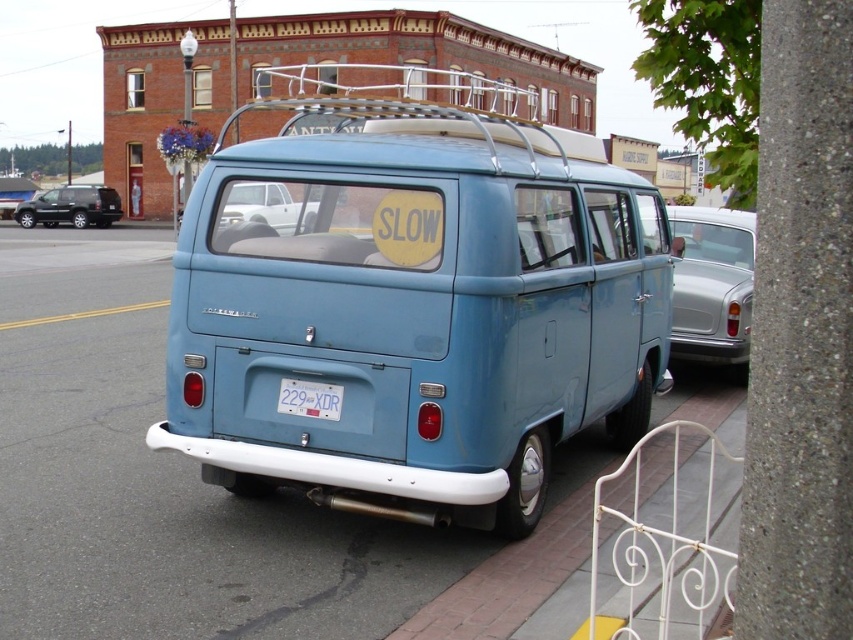
Describe the element at coordinates (412, 304) in the screenshot. Image resolution: width=853 pixels, height=640 pixels. I see `matte blue van at center` at that location.

The height and width of the screenshot is (640, 853). In order to click on matte blue van at center in this screenshot , I will do `click(412, 304)`.

The height and width of the screenshot is (640, 853). What do you see at coordinates (508, 580) in the screenshot? I see `brick sidewalk at lower right` at bounding box center [508, 580].

Who is shorter, brick sidewalk at lower right or metallic silver sedan at right?

brick sidewalk at lower right

The height and width of the screenshot is (640, 853). Identify the location of brick sidewalk at lower right. (508, 580).

Is point (96, 264) more distant than point (96, 195)?

That is False.

Which is in front, point (161, 627) or point (41, 204)?

Positioned in front is point (161, 627).

Locate an element on the screen. Image resolution: width=853 pixels, height=640 pixels. smooth asphalt pavement at center is located at coordinates (202, 490).